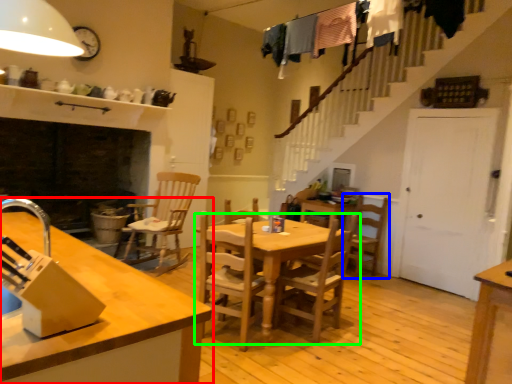
Question: Estimate the real-world distances between objects in this image. Which object is farther from countertop (highlighted by a red box), chair (highlighted by a blue box) or kitchen & dining room table (highlighted by a green box)?

Choices:
 (A) chair
 (B) kitchen & dining room table

Answer: (A)